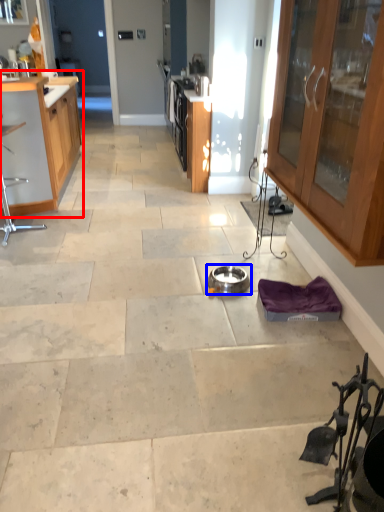
Question: Which of the following is the closest to the observer, cabinetry (highlighted by a red box) or appliance (highlighted by a blue box)?

Choices:
 (A) cabinetry
 (B) appliance

Answer: (B)